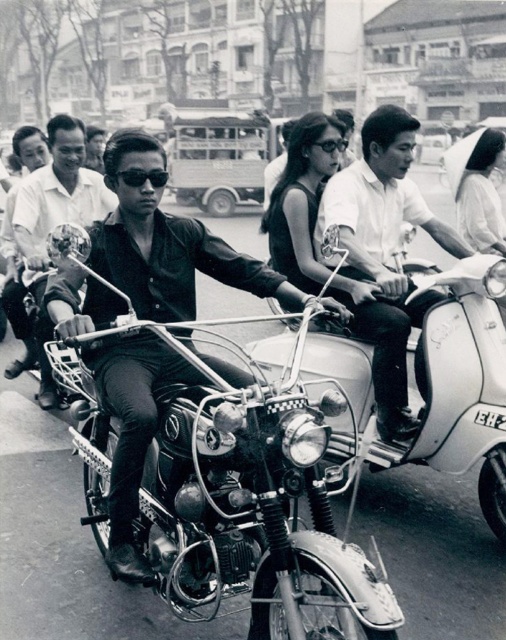
Can you confirm if black matte sunglasses at center is positioned below black plastic goggles at center?

Indeed, black matte sunglasses at center is positioned under black plastic goggles at center.

Does point (147, 172) lie behind point (345, 145)?

No, it is in front of (345, 145).

Find the location of `black matte sunglasses at center`. black matte sunglasses at center is located at coordinates (142, 177).

Is point (99, 396) positioned in front of point (327, 148)?

Yes.

Does shiny chrome motorcycle at center have a larger size compared to black plastic goggles at center?

Yes.

Consider the image. Who is more forward, (x=387, y=637) or (x=332, y=150)?

Positioned in front is point (x=387, y=637).

What are the coordinates of `shiny chrome motorcycle at center` in the screenshot? It's located at (224, 481).

Looking at this image, which is above, metallic chrome motorcycle at center or black plastic goggles at center?

black plastic goggles at center is higher up.

Describe the element at coordinates (457, 381) in the screenshot. This screenshot has width=506, height=640. I see `metallic chrome motorcycle at center` at that location.

The width and height of the screenshot is (506, 640). I want to click on metallic chrome motorcycle at center, so click(457, 381).